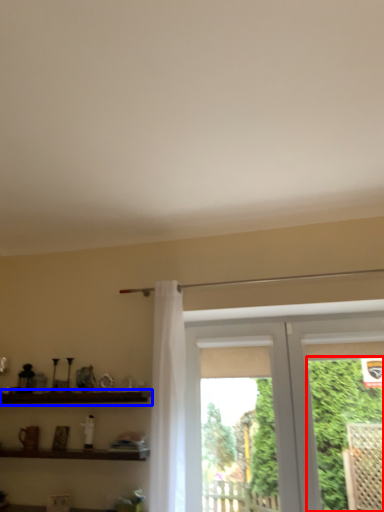
Question: Among these objects, which one is nearest to the camera, plant (highlighted by a red box) or shelf (highlighted by a blue box)?

Choices:
 (A) plant
 (B) shelf

Answer: (A)